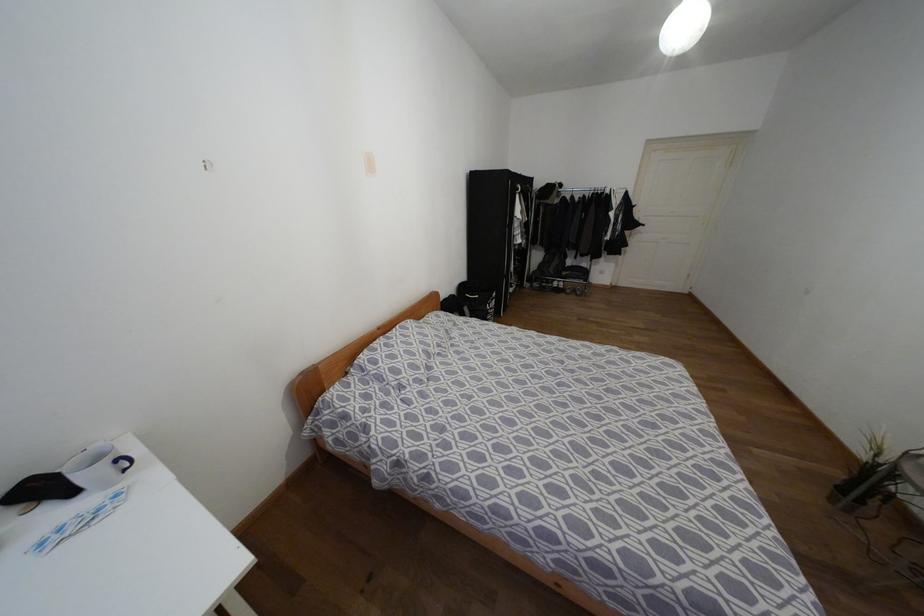
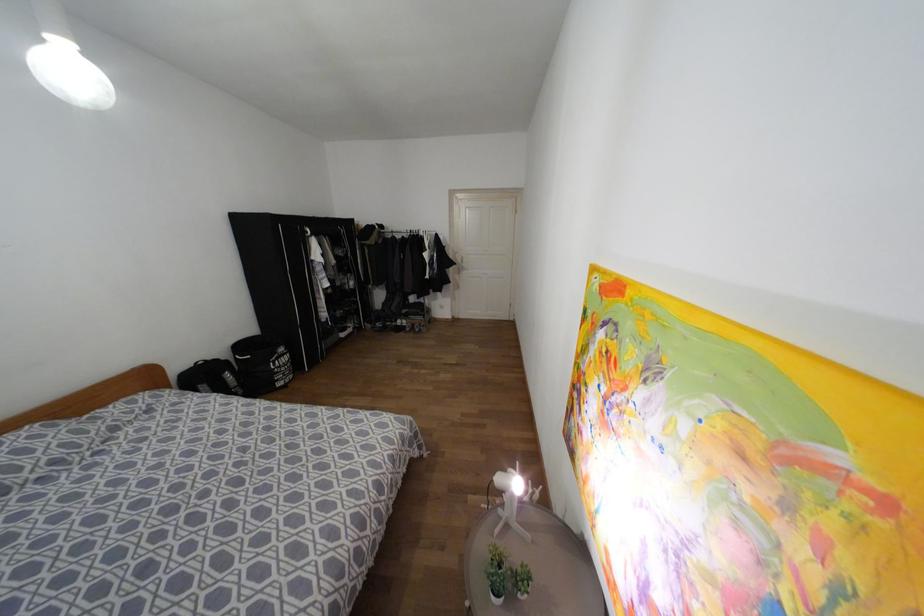
The point at (x=606, y=191) is marked in the first image. Where is the corresponding point in the second image?

(419, 233)